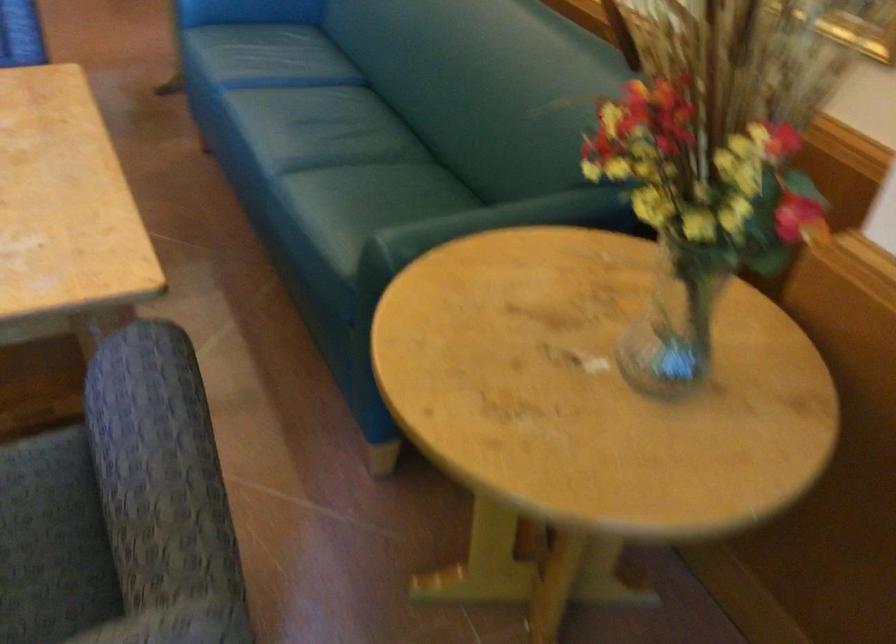
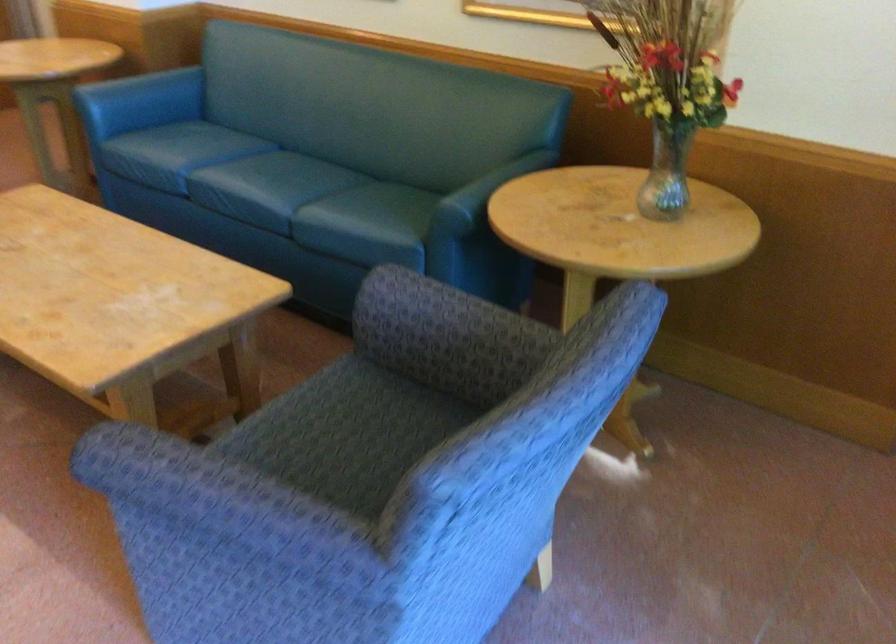
The point at (273, 136) is marked in the first image. Where is the corresponding point in the second image?

(269, 187)